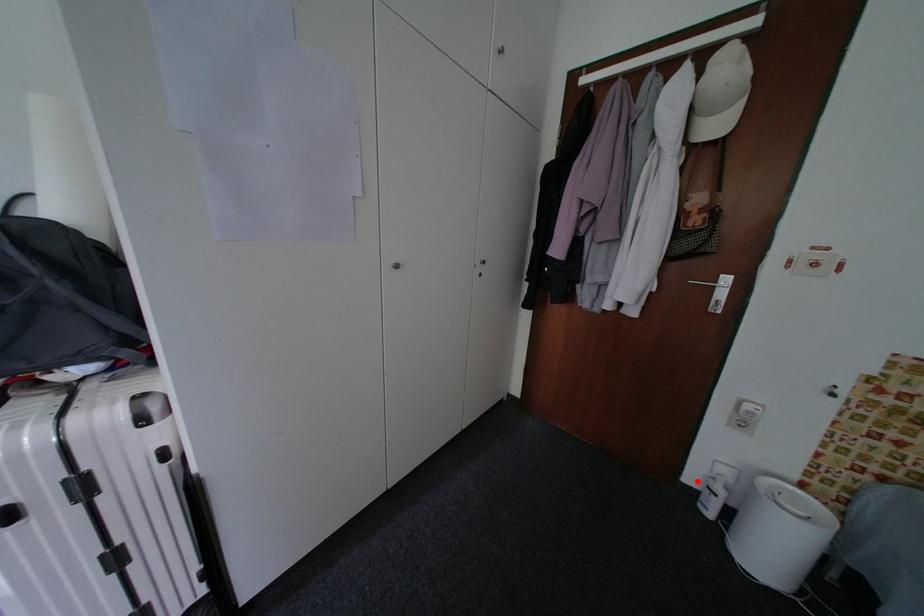
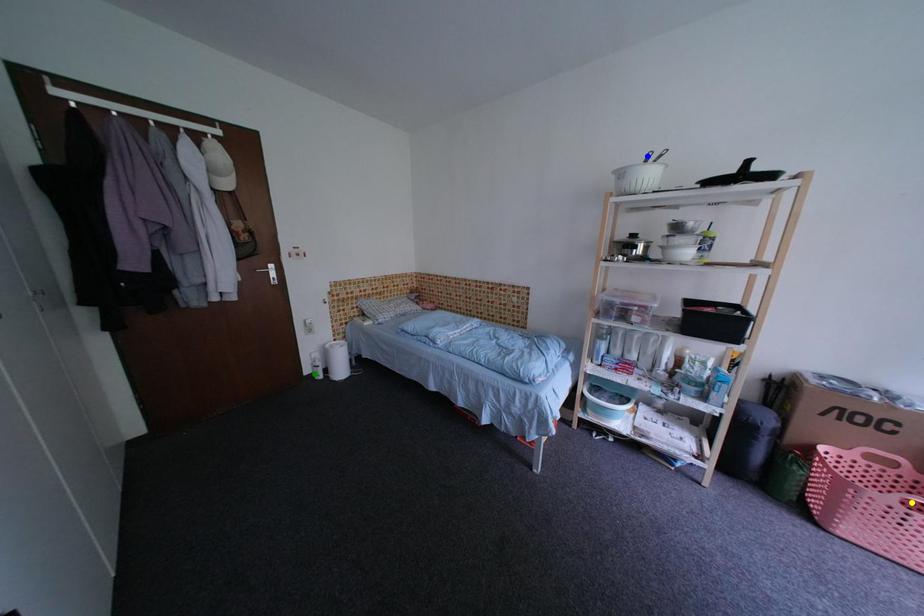
Question: I am providing you with two images of the same scene from different viewpoints. A red point is marked on the first image. You are given multiple points on the second image. Which mark in image 2 goes with the point in image 1?

Choices:
 (A) blue point
 (B) green point
 (C) yellow point

Answer: (B)